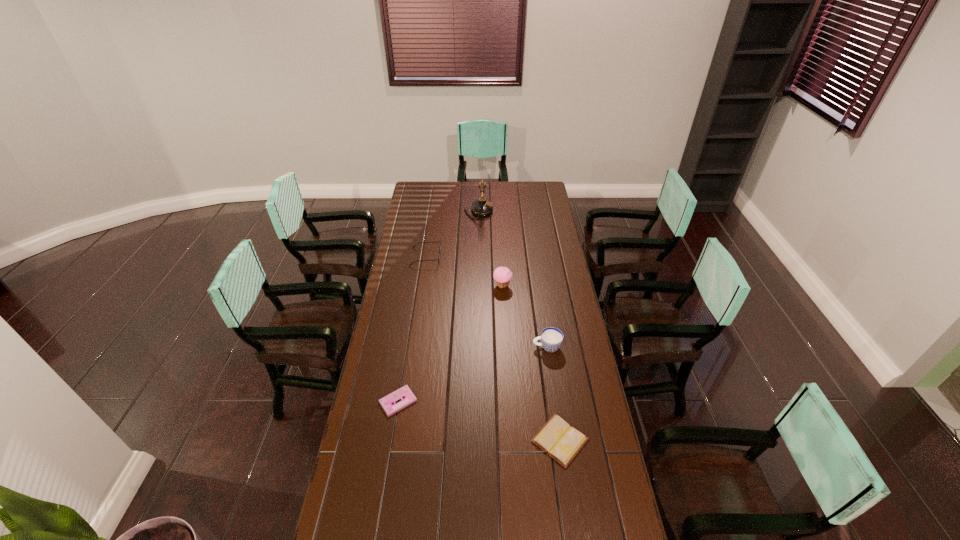
This screenshot has width=960, height=540. Find the location of `the farthest object`. the farthest object is located at coordinates (481, 207).

At what (x,y) coordinates should I click in order to perform the action: click on telephone. Please return your answer as a coordinate pair (x, y). The width and height of the screenshot is (960, 540). Looking at the image, I should click on (481, 207).

Identify the location of the second tallest object. (502, 275).

Where is `the fourth nearest object`? the fourth nearest object is located at coordinates (502, 275).

I want to click on the third nearest object, so click(551, 338).

I want to click on cup, so click(x=551, y=338).

What are the coordinates of `spectacles` in the screenshot? It's located at (439, 241).

Locate an element on the screen. The image size is (960, 540). the second farthest object is located at coordinates (439, 241).

Where is `the second shortest object`? This screenshot has width=960, height=540. the second shortest object is located at coordinates (557, 438).

The image size is (960, 540). Identify the location of the shortest object. (388, 403).